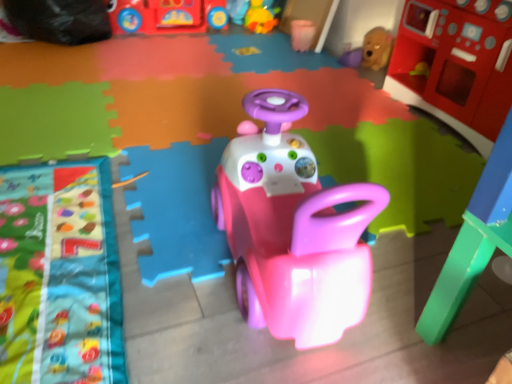
Find the location of a particular element. This screenshot has width=512, height=384. free region on the left part of matte brown teddy bear at upper right, acting as the 2th toy starting from the right is located at coordinates (332, 61).